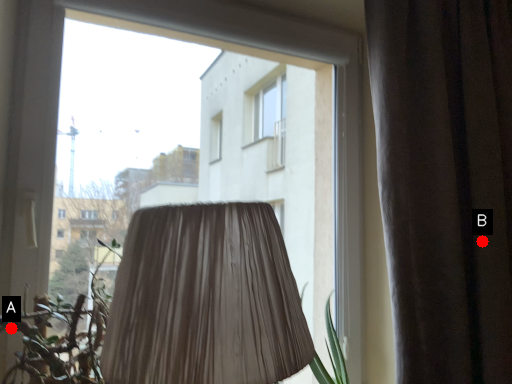
Question: Two points are circled on the image, labeled by A and B beside each circle. Which point appears farthest from the camera in this image?

Choices:
 (A) A is further
 (B) B is further

Answer: (B)